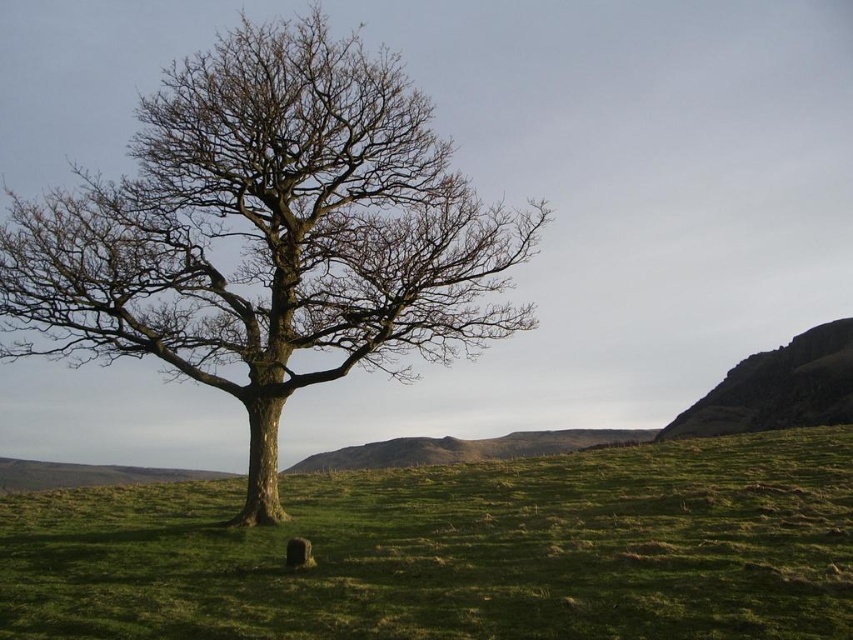
You are standing at the base of the tree in the image. Looking around, you notice a point marked at coordinates point (457, 550). What is located at that point?

The green grassy field at center is located at point (457, 550).

You are standing at the base of the solitary tree in the image. Looking around, you notice a point marked at coordinates point (457, 550). What is located at that point?

The green grassy field at center is located at point (457, 550).

You are planning to place a new bench in the landscape scene. The bench requires a space wider than the rugged stone hillside at right. Can the smooth bark tree at center provide enough space for the bench?

The smooth bark tree at center has a width larger than the rugged stone hillside at right, so it can provide sufficient space for the bench that requires a width greater than the rugged stone hillside at right.